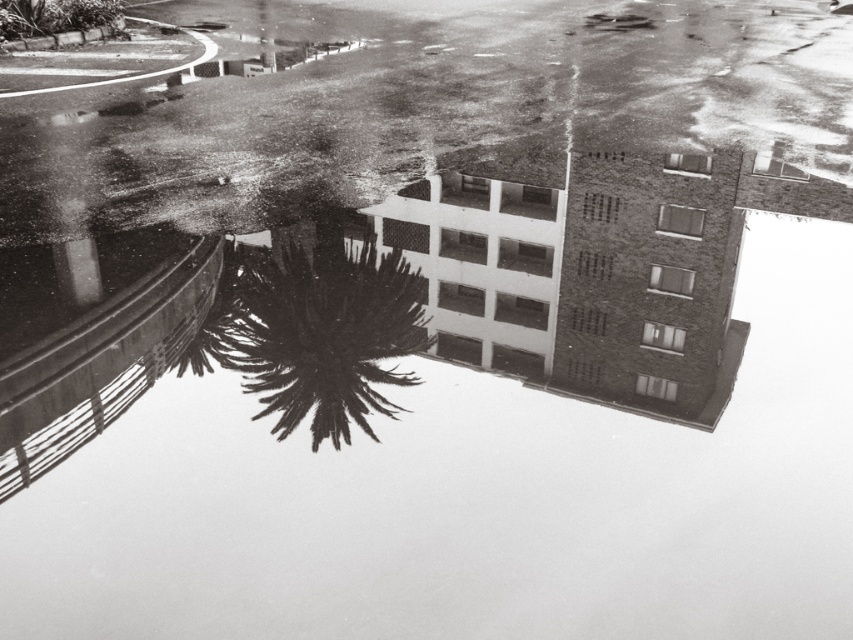
Question: Is dark green spiky palm tree at center positioned at the back of green leafy tree at upper left?

Choices:
 (A) yes
 (B) no

Answer: (B)

Question: Is dark green spiky palm tree at center to the left of green leafy tree at upper left from the viewer's perspective?

Choices:
 (A) no
 (B) yes

Answer: (A)

Question: Does dark green spiky palm tree at center appear on the right side of green leafy tree at upper left?

Choices:
 (A) yes
 (B) no

Answer: (A)

Question: Which point is closer to the camera?

Choices:
 (A) (119, 8)
 (B) (363, 330)

Answer: (B)

Question: Which of the following is the farthest from the observer?

Choices:
 (A) green leafy tree at upper left
 (B) dark green spiky palm tree at center

Answer: (A)

Question: Which point is closer to the camera?

Choices:
 (A) green leafy tree at upper left
 (B) dark green spiky palm tree at center

Answer: (B)